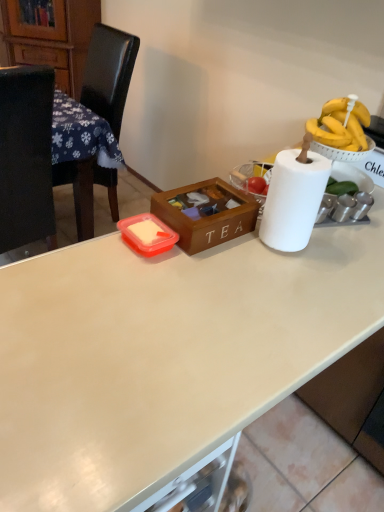
Question: Considering the positions of white matte table at left and wooden tea box at center in the image, is white matte table at left taller or shorter than wooden tea box at center?

Choices:
 (A) short
 (B) tall

Answer: (B)

Question: In terms of width, does white matte table at left look wider or thinner when compared to wooden tea box at center?

Choices:
 (A) wide
 (B) thin

Answer: (A)

Question: Based on their relative distances, which object is nearer to the wooden cabinet at left?

Choices:
 (A) black leather chair at left
 (B) white matte desk at center
 (C) wooden tea box at center
 (D) white matte table at left

Answer: (A)

Question: Which is farther from the wooden tea box at center?

Choices:
 (A) wooden cabinet at left
 (B) black leather chair at left
 (C) white matte table at left
 (D) white matte desk at center

Answer: (A)